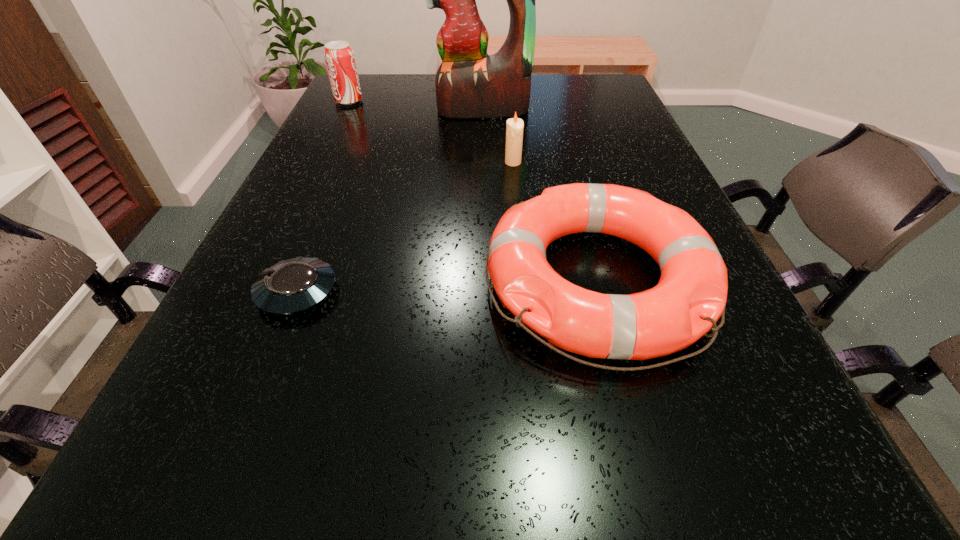
The image size is (960, 540). Identify the location of the tallest object. (469, 83).

The height and width of the screenshot is (540, 960). What are the coordinates of `the second tallest object` in the screenshot? It's located at (339, 57).

Locate an element on the screen. candle is located at coordinates tap(514, 126).

Locate an element on the screen. The height and width of the screenshot is (540, 960). the third farthest object is located at coordinates (514, 126).

You are a GUI agent. You are given a task and a screenshot of the screen. Output one action in this format:
    pyautogui.click(x=<x>, y=<y>)
    Task: Click on the life buoy
    Image resolution: width=960 pixels, height=540 pixels.
    Given the screenshot: What is the action you would take?
    pyautogui.click(x=690, y=297)

Where is `the shortest object`? This screenshot has width=960, height=540. the shortest object is located at coordinates (293, 285).

I want to click on free space located at the face of the parrot, so click(484, 174).

In order to click on vacant region located 0.140m on the logo side of the second tallest object in this screenshot , I will do `click(412, 101)`.

The image size is (960, 540). What are the coordinates of `vacant area situated 0.220m on the right of the third nearest object` in the screenshot? It's located at (617, 163).

Identify the location of vacant space situated 0.120m on the front of the fourth tallest object. (647, 471).